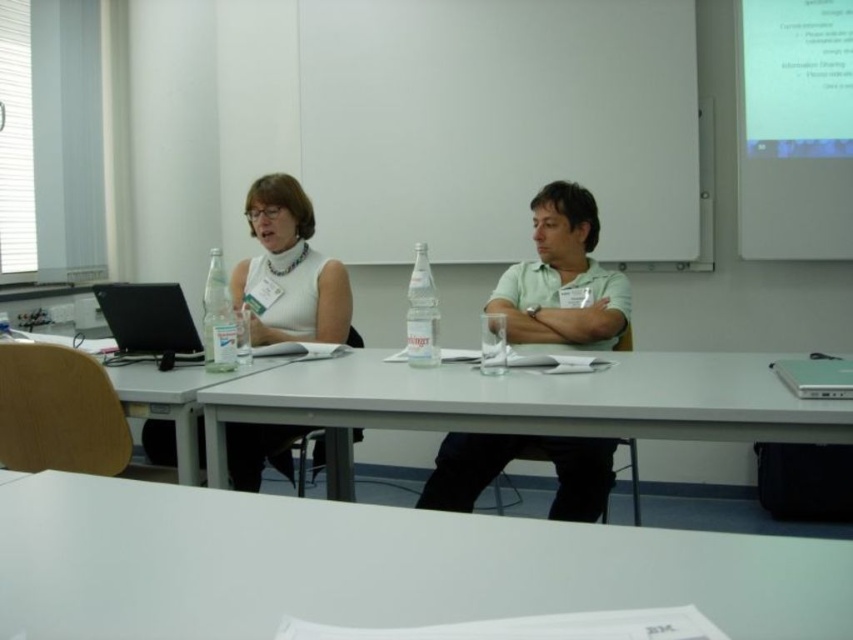
Question: Is black glossy laptop at left closer to the viewer compared to silver metallic laptop at right?

Choices:
 (A) yes
 (B) no

Answer: (B)

Question: Among these objects, which one is nearest to the camera?

Choices:
 (A) green matte shirt at center
 (B) wooden table at left
 (C) white matte shirt at center

Answer: (B)

Question: Which object is the closest to the silver metallic laptop at right?

Choices:
 (A) black glossy laptop at left
 (B) white matte shirt at center
 (C) green matte shirt at center

Answer: (C)

Question: Does black glossy laptop at left have a smaller size compared to silver metallic laptop at right?

Choices:
 (A) yes
 (B) no

Answer: (B)

Question: Does white matte shirt at center come behind wooden table at left?

Choices:
 (A) yes
 (B) no

Answer: (A)

Question: Which point is closer to the camera?

Choices:
 (A) white matte table at center
 (B) clear plastic bottle at center
 (C) silver metallic laptop at right

Answer: (A)